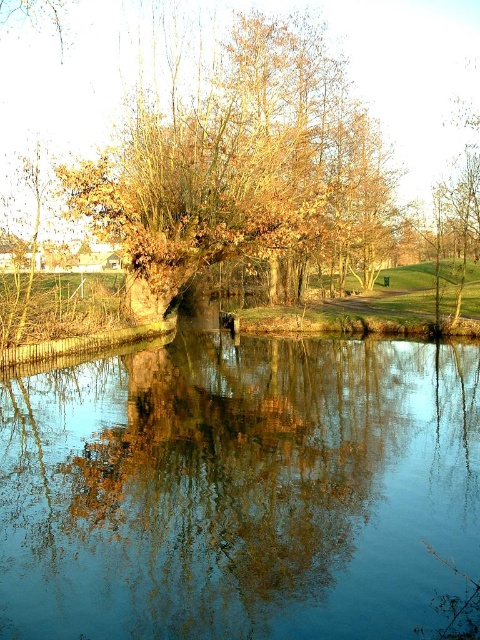
In order to click on blue reflective water at center in this screenshot , I will do `click(239, 490)`.

Which is below, blue reflective water at center or brown leafy tree at center?

blue reflective water at center is below.

Which is in front, point (67, 577) or point (230, 33)?

Positioned in front is point (67, 577).

Find the location of `blue reflective water at center`. blue reflective water at center is located at coordinates (239, 490).